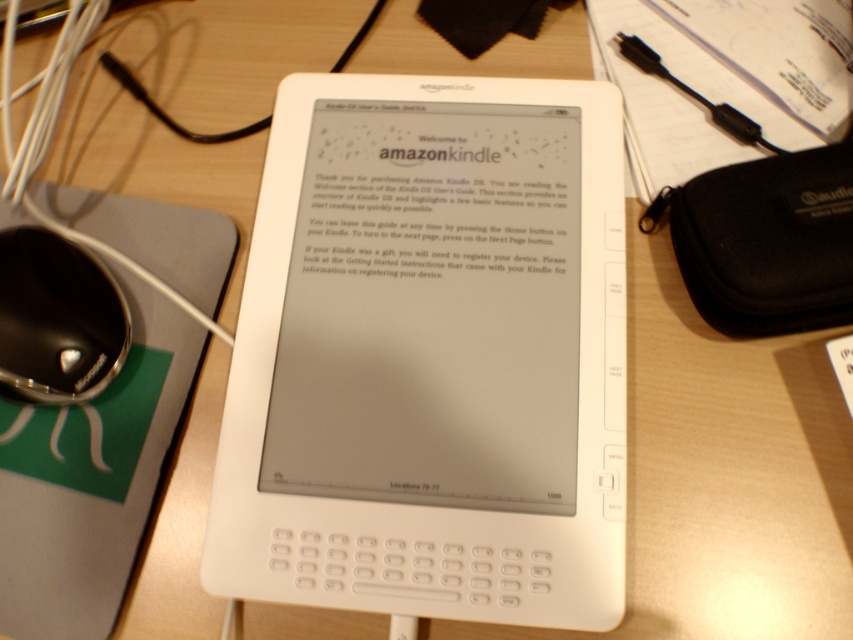
Question: Can you confirm if white matte e-reader at center is positioned above black glossy mouse at left?

Choices:
 (A) no
 (B) yes

Answer: (A)

Question: Observing the image, what is the correct spatial positioning of white matte e-reader at center in reference to black glossy mouse at left?

Choices:
 (A) below
 (B) above

Answer: (A)

Question: Can you confirm if white matte e-reader at center is positioned below black glossy mouse at left?

Choices:
 (A) no
 (B) yes

Answer: (B)

Question: Which point is closer to the camera taking this photo?

Choices:
 (A) (590, 236)
 (B) (55, 284)

Answer: (B)

Question: Which object appears closest to the camera in this image?

Choices:
 (A) white matte e-reader at center
 (B) black glossy mouse at left

Answer: (A)